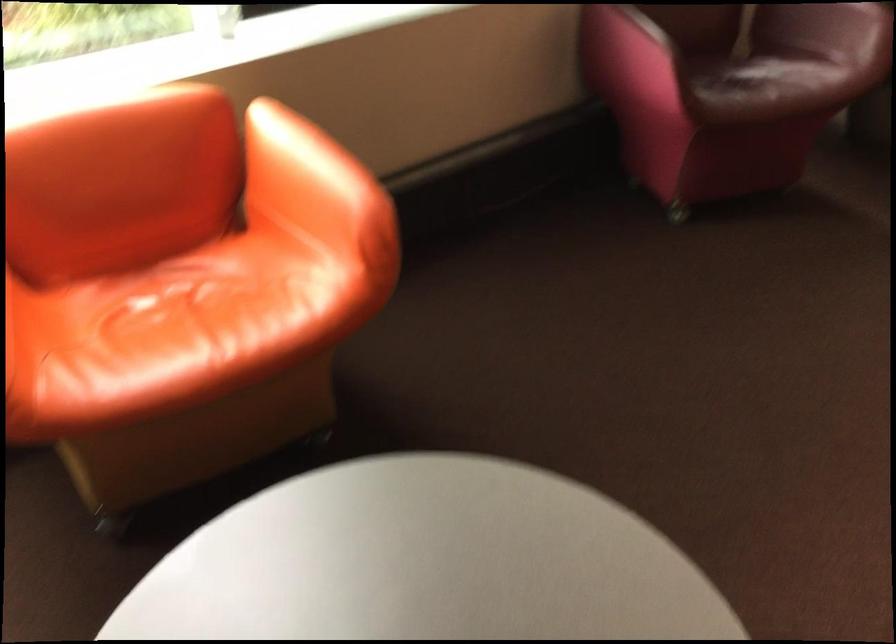
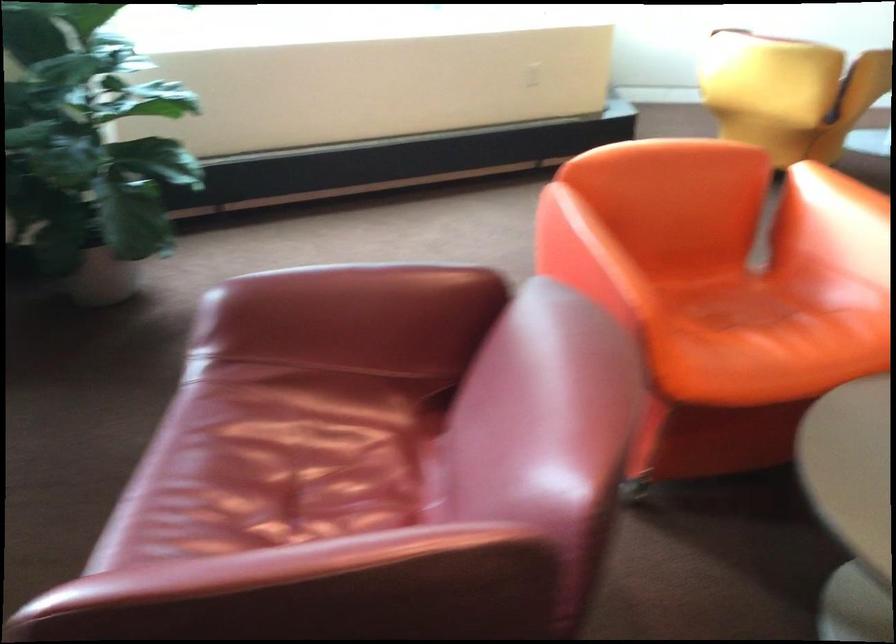
Question: What movement of the cameraman would produce the second image?

Choices:
 (A) Left
 (B) Right
 (C) Forward
 (D) Backward

Answer: (B)